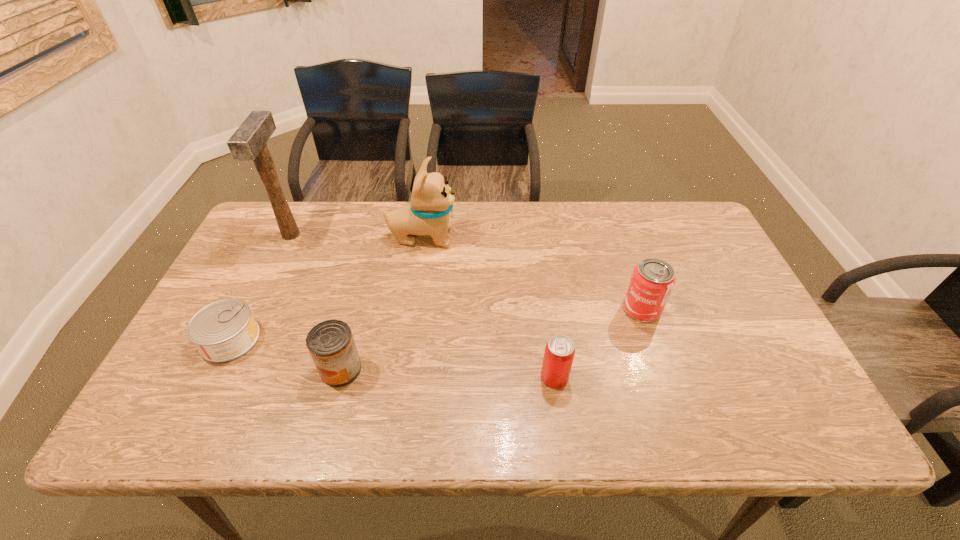
Where is `vacant region that satisfies the following two spatial constraints: 1. on the face of the rightmost object; 2. on the left side of the fifth shortest object`? This screenshot has height=540, width=960. vacant region that satisfies the following two spatial constraints: 1. on the face of the rightmost object; 2. on the left side of the fifth shortest object is located at coordinates (412, 309).

You are a GUI agent. You are given a task and a screenshot of the screen. Output one action in this format:
    pyautogui.click(x=<x>, y=<y>)
    Task: Click on the vacant region that satisfies the following two spatial constraints: 1. on the back side of the rightmost can; 2. on the face of the fifth shortest object
    
    Given the screenshot: What is the action you would take?
    pyautogui.click(x=617, y=237)

I want to click on free region that satisfies the following two spatial constraints: 1. on the face of the puppy; 2. on the front side of the shortest object, so click(x=408, y=339).

I want to click on free spot that satisfies the following two spatial constraints: 1. on the front side of the tallest object; 2. on the left side of the rightmost object, so click(x=255, y=309).

You are a GUI agent. You are given a task and a screenshot of the screen. Output one action in this format:
    pyautogui.click(x=<x>, y=<y>)
    Task: Click on the vacant space that satisfies the following two spatial constraints: 1. on the front side of the third can from right to left; 2. on the left side of the mallet
    Image resolution: width=960 pixels, height=540 pixels.
    Given the screenshot: What is the action you would take?
    pyautogui.click(x=228, y=369)

The height and width of the screenshot is (540, 960). What are the coordinates of `vacant space that satisfies the following two spatial constraints: 1. on the face of the fifth shortest object; 2. on the right side of the rightmost can` in the screenshot? It's located at pyautogui.click(x=412, y=309).